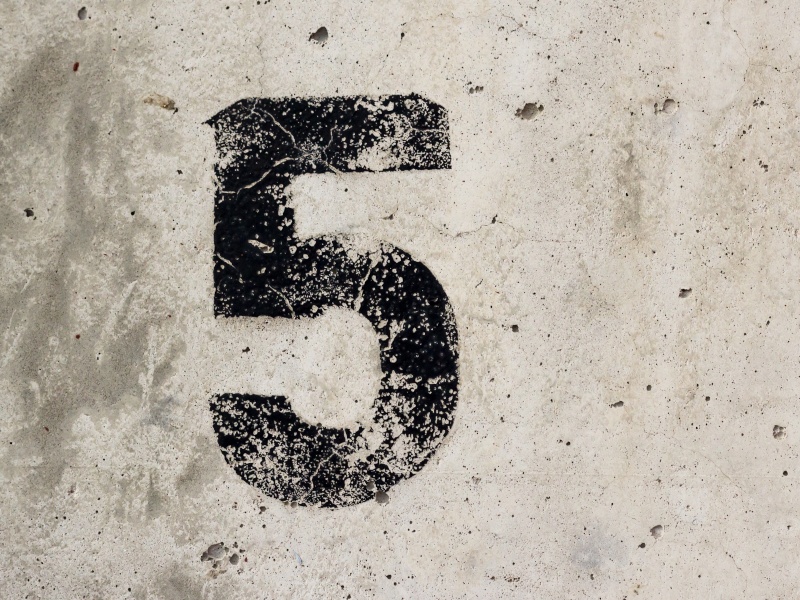
Identify the location of wall. Image resolution: width=800 pixels, height=600 pixels. (650, 287).